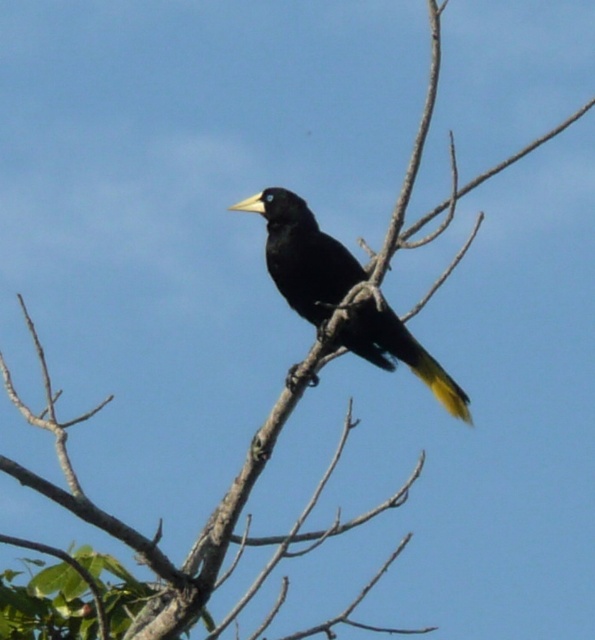
You are an ornithologist studying the spatial positioning of birds in their habitats. You observe the black glossy bird at center in the image. What are the coordinates of its position?

The black glossy bird at center is located at coordinates 0.400 in the x axis and 0.509 in the y axis.

You are an ornithologist observing the black glossy bird at center and its yellow matte tail at center. Which part of the bird is taller?

The black glossy bird at center is taller than the yellow matte tail at center.